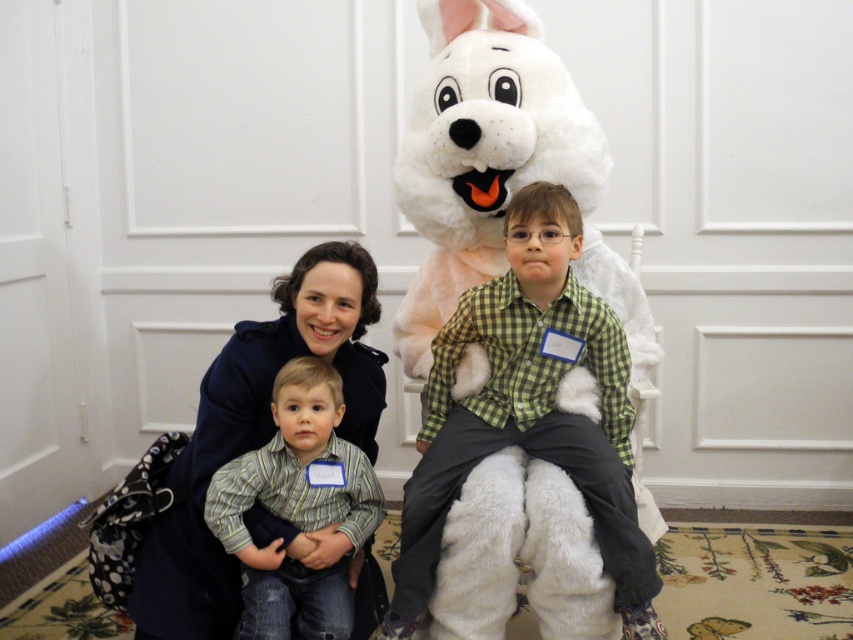
What is the color of the shirt worn by the person located at the coordinates point (529, 410)?

The green checkered shirt at center is the color green.

You are a photographer setting up for a group photo. You need to arrange the subjects so that the green checkered shirt at center and the striped shirt at center are visible. Considering their heights, which subject should you position closer to the front to ensure both are fully visible?

Since the green checkered shirt at center is taller than the striped shirt at center, you should place the striped shirt at center closer to the front to ensure both are fully visible.